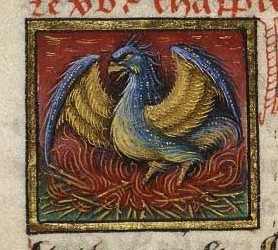
Find the location of a particular element. bottom left gold corner of framed bird picture is located at coordinates (33, 228).